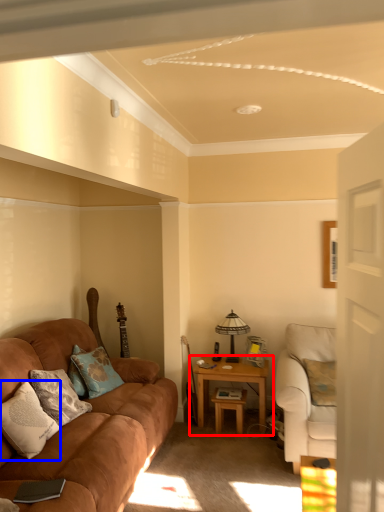
Question: Among these objects, which one is farthest to the camera, table (highlighted by a red box) or pillow (highlighted by a blue box)?

Choices:
 (A) table
 (B) pillow

Answer: (A)